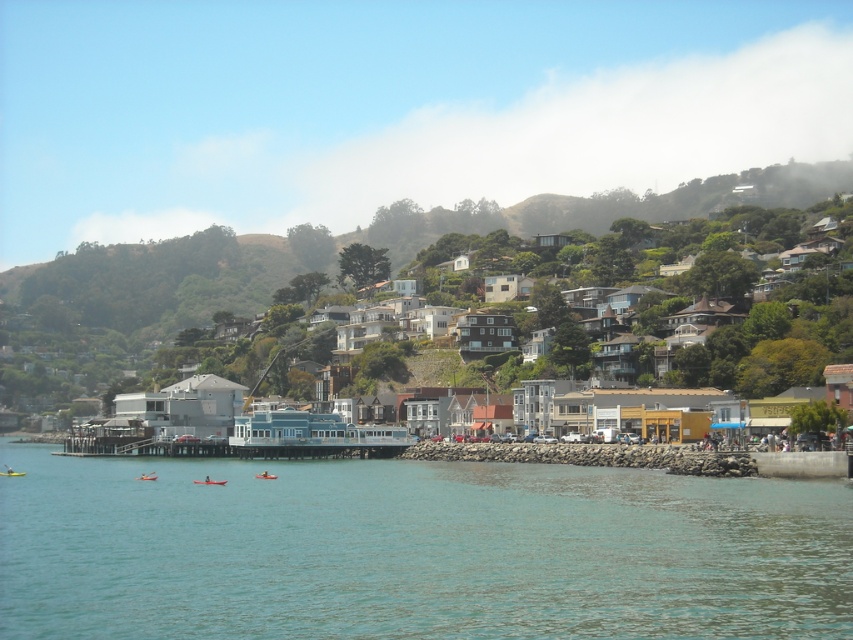
You are planning to organize a kayaking activity for a group of tourists. You have two kayaks available in the scene. Which kayak, the clear blue water at center or the orange kayak at lower left, is more suitable for accommodating more people?

The clear blue water at center is larger in size than the orange kayak at lower left, so the clear blue water at center can accommodate more people.

You are a tour guide leading a group of visitors to the coastal town. You want to ensure they can see both the orange kayak at center and the yellow plastic kayak at lower left from a single vantage point. Based on their positions, is there a spot where both kayaks are visible at the same time?

Yes, since the orange kayak at center and the yellow plastic kayak at lower left are only 21.97 meters apart, there should be a vantage point where both are visible simultaneously, provided there are no obstructions like the rocky jetty or buildings between them.

You are planning to take a photo of the orange kayak at lower left and the clear blue water at center. Which object should you focus on first if you want to capture both in a single frame without moving the camera?

→ You should focus on the clear blue water at center first because it is wider than the orange kayak at lower left, so it will take up more space in the frame.